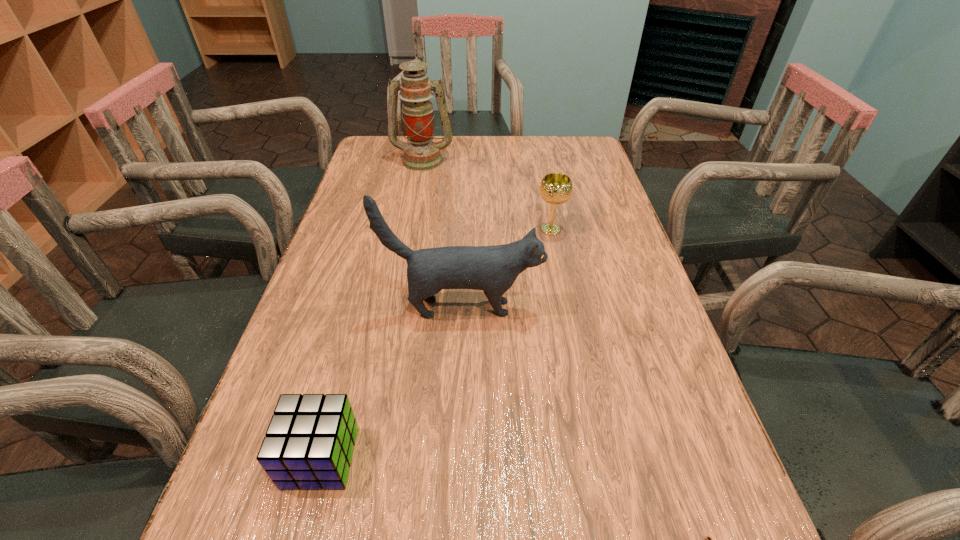
You are a GUI agent. You are given a task and a screenshot of the screen. Output one action in this format:
    pyautogui.click(x=<x>, y=<y>)
    Task: Click on the oil lamp positioned at the left edge
    
    Given the screenshot: What is the action you would take?
    pyautogui.click(x=421, y=154)

Where is `cube that is at the left edge`? Image resolution: width=960 pixels, height=540 pixels. cube that is at the left edge is located at coordinates (309, 444).

Locate an element on the screen. The image size is (960, 540). object positioned at the right edge is located at coordinates (555, 188).

The image size is (960, 540). I want to click on object present at the far left corner, so click(x=421, y=154).

Where is `vacant space at the far edge`? vacant space at the far edge is located at coordinates (476, 153).

At what (x,y) coordinates should I click in order to perform the action: click on free region at the left edge of the desktop. Please return your answer as a coordinate pair (x, y). The width and height of the screenshot is (960, 540). Looking at the image, I should click on (376, 179).

You are a GUI agent. You are given a task and a screenshot of the screen. Output one action in this format:
    pyautogui.click(x=<x>, y=<y>)
    Task: Click on the vacant space at the right edge
    This screenshot has width=960, height=540.
    Given the screenshot: What is the action you would take?
    pyautogui.click(x=643, y=390)

Where is `free region at the far right corner`? The image size is (960, 540). free region at the far right corner is located at coordinates (574, 150).

Where is `free space between the second object from right to left and the cube`? Image resolution: width=960 pixels, height=540 pixels. free space between the second object from right to left and the cube is located at coordinates (436, 343).

Locate an element on the screen. Image resolution: width=960 pixels, height=540 pixels. free space between the third farthest object and the farthest object is located at coordinates (443, 234).